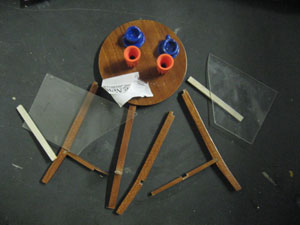
Where is `right blue cup`? right blue cup is located at coordinates (170, 46).